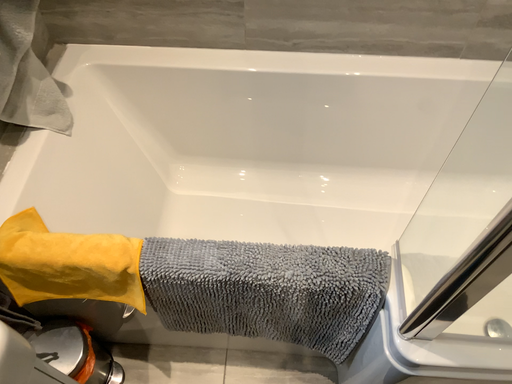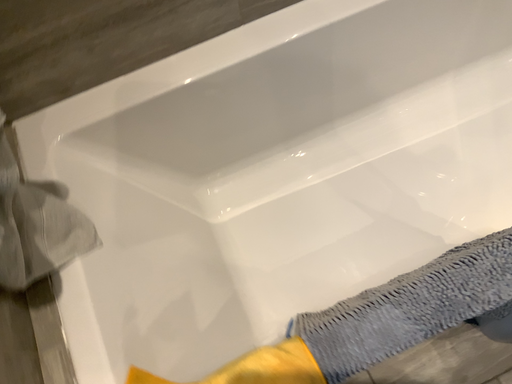
Question: How did the camera likely rotate when shooting the video?

Choices:
 (A) rotated downward
 (B) rotated upward

Answer: (A)